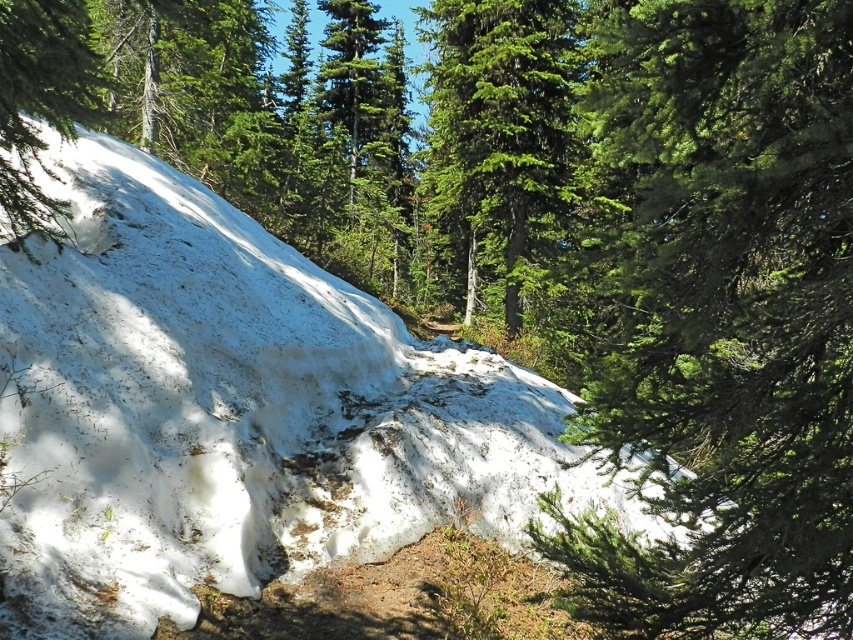
Question: Can you confirm if green glossy tree at center is positioned above green matte tree at upper left?

Choices:
 (A) no
 (B) yes

Answer: (B)

Question: Which point appears farthest from the camera in this image?

Choices:
 (A) (767, 205)
 (B) (444, 67)

Answer: (B)

Question: Is green textured pine tree at upper right below green glossy tree at center?

Choices:
 (A) no
 (B) yes

Answer: (B)

Question: Is the position of green textured pine tree at upper right more distant than that of green glossy tree at center?

Choices:
 (A) no
 (B) yes

Answer: (A)

Question: Among these objects, which one is nearest to the camera?

Choices:
 (A) green textured pine tree at upper right
 (B) green matte tree at upper left

Answer: (A)

Question: Which point appears closest to the camera in this image?

Choices:
 (A) (19, 33)
 (B) (427, 80)

Answer: (A)